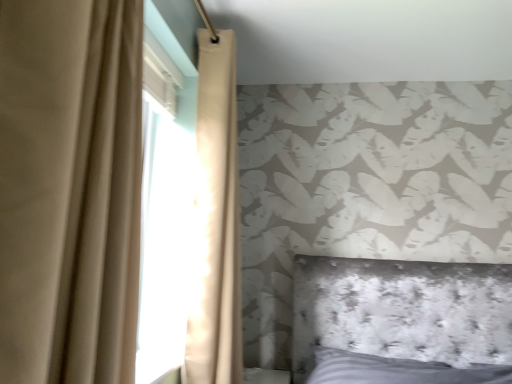
Question: From a real-world perspective, relative to beige fabric curtain at left, which appears as the 1th curtain when viewed from the front, is beige fabric curtain at upper left, acting as the first curtain starting from the back, vertically above or below?

Choices:
 (A) above
 (B) below

Answer: (A)

Question: Do you think beige fabric curtain at upper left, acting as the first curtain starting from the back, is within beige fabric curtain at left, which appears as the 1th curtain when viewed from the front, or outside of it?

Choices:
 (A) outside
 (B) inside

Answer: (A)

Question: Considering the positions of beige fabric curtain at upper left, which is the 2th curtain in front-to-back order, and beige fabric curtain at left, placed as the 2th curtain when sorted from back to front, in the image, is beige fabric curtain at upper left, which is the 2th curtain in front-to-back order, bigger or smaller than beige fabric curtain at left, placed as the 2th curtain when sorted from back to front,?

Choices:
 (A) small
 (B) big

Answer: (B)

Question: Would you say beige fabric curtain at left, which appears as the 1th curtain when viewed from the front, is to the left or to the right of beige fabric curtain at upper left, acting as the first curtain starting from the back, in the picture?

Choices:
 (A) left
 (B) right

Answer: (A)

Question: Relative to beige fabric curtain at upper left, which is the 2th curtain in front-to-back order, is beige fabric curtain at left, which appears as the 1th curtain when viewed from the front, in front or behind?

Choices:
 (A) behind
 (B) front

Answer: (B)

Question: From a real-world perspective, is beige fabric curtain at left, placed as the 2th curtain when sorted from back to front, positioned above or below beige fabric curtain at upper left, acting as the first curtain starting from the back?

Choices:
 (A) above
 (B) below

Answer: (B)

Question: In terms of height, does beige fabric curtain at left, placed as the 2th curtain when sorted from back to front, look taller or shorter compared to beige fabric curtain at upper left, acting as the first curtain starting from the back?

Choices:
 (A) short
 (B) tall

Answer: (A)